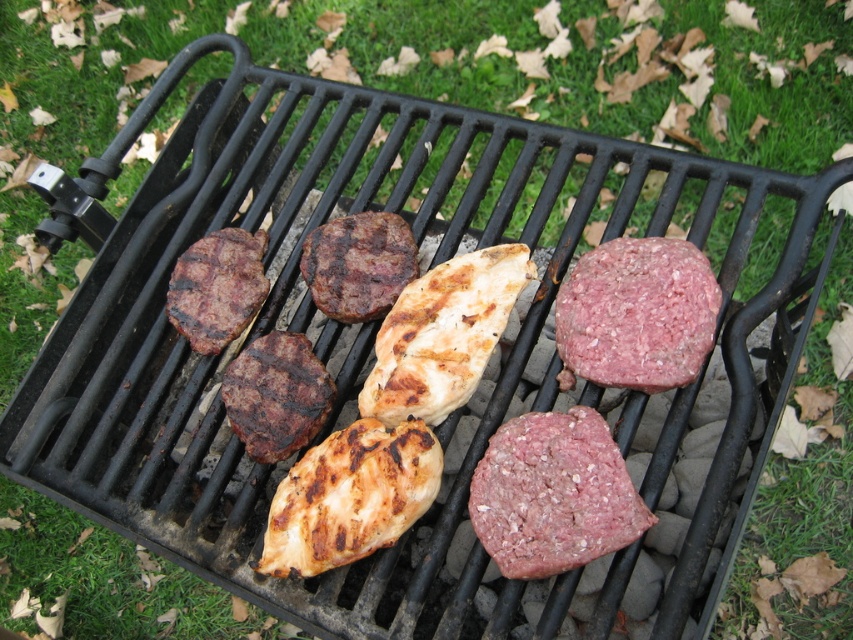
Can you confirm if raw ground beef at bottom right is positioned below raw pinkish-red meat at center-right?

Yes, raw ground beef at bottom right is below raw pinkish-red meat at center-right.

Does raw ground beef at bottom right have a greater width compared to raw pinkish-red meat at center-right?

In fact, raw ground beef at bottom right might be narrower than raw pinkish-red meat at center-right.

Where is `raw ground beef at bottom right`? The height and width of the screenshot is (640, 853). raw ground beef at bottom right is located at coordinates (553, 493).

Identify the location of raw ground beef at bottom right. (553, 493).

Does raw pinkish-red meat at center-right have a lesser height compared to brown charred beef at center?

No, raw pinkish-red meat at center-right is not shorter than brown charred beef at center.

Does point (618, 301) come in front of point (260, 374)?

Yes, it is in front of point (260, 374).

Where is `raw pinkish-red meat at center-right`? This screenshot has height=640, width=853. raw pinkish-red meat at center-right is located at coordinates (637, 314).

Between point (512, 545) and point (212, 250), which one is positioned behind?

The point (212, 250) is more distant.

Does raw ground beef at bottom right have a greater width compared to grilled brown steak at left?

Indeed, raw ground beef at bottom right has a greater width compared to grilled brown steak at left.

Is point (538, 417) in front of point (178, 266)?

Yes.

Where is `raw ground beef at bottom right`? raw ground beef at bottom right is located at coordinates (553, 493).